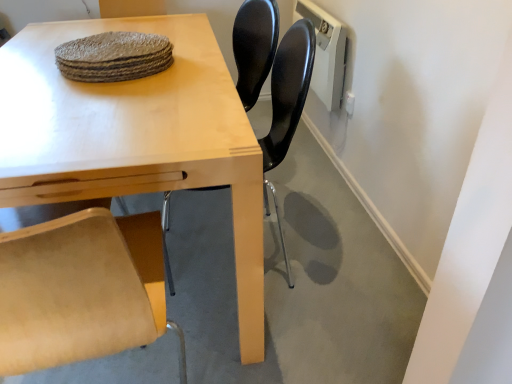
Question: From a real-world perspective, is light wood table at center positioned above or below light wood table at center?

Choices:
 (A) above
 (B) below

Answer: (A)

Question: In terms of size, does light wood table at center appear bigger or smaller than light wood table at center?

Choices:
 (A) small
 (B) big

Answer: (B)

Question: Which object is the farthest from the rough woven placemat at upper center?

Choices:
 (A) light wood table at center
 (B) black plastic chair at center
 (C) light wood table at center

Answer: (B)

Question: Which is nearer to the black plastic chair at center?

Choices:
 (A) light wood table at center
 (B) rough woven placemat at upper center
 (C) light wood table at center

Answer: (A)